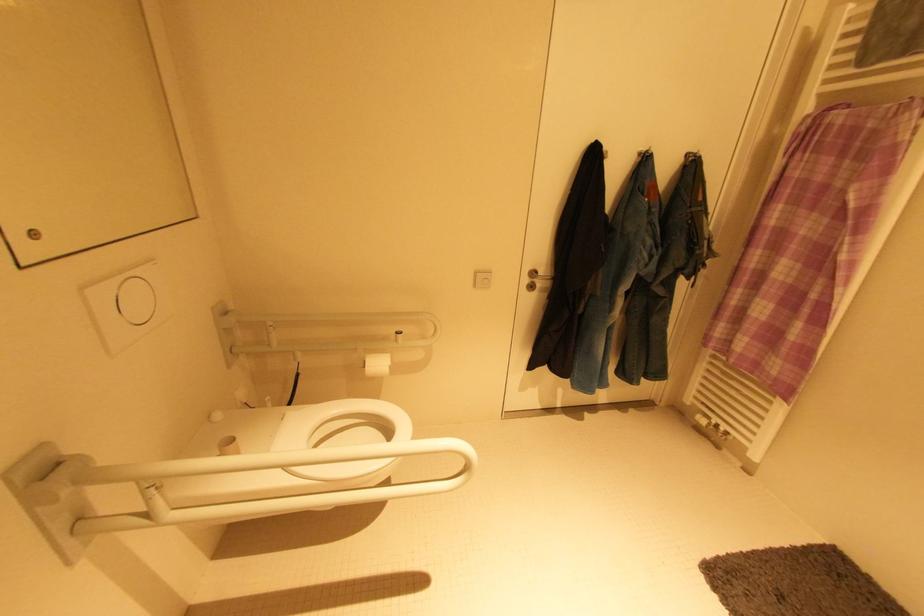
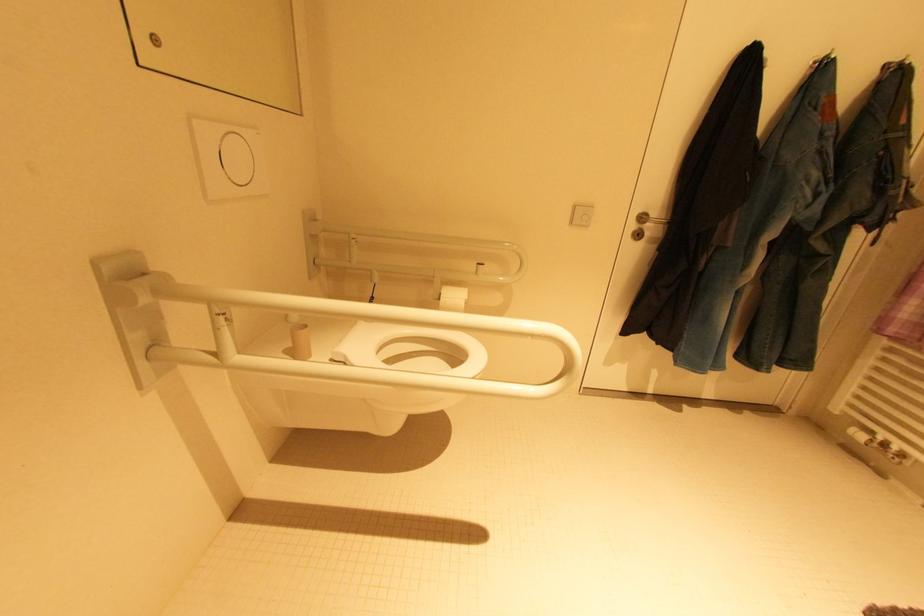
Question: The first image is from the beginning of the video and the second image is from the end. How did the camera likely rotate when shooting the video?

Choices:
 (A) Left
 (B) Right
 (C) Up
 (D) Down

Answer: (A)